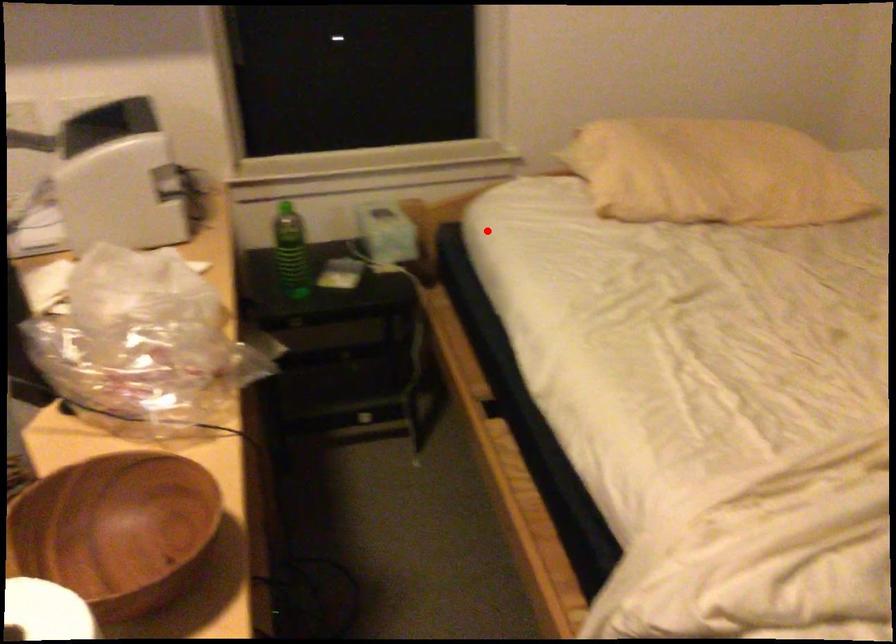
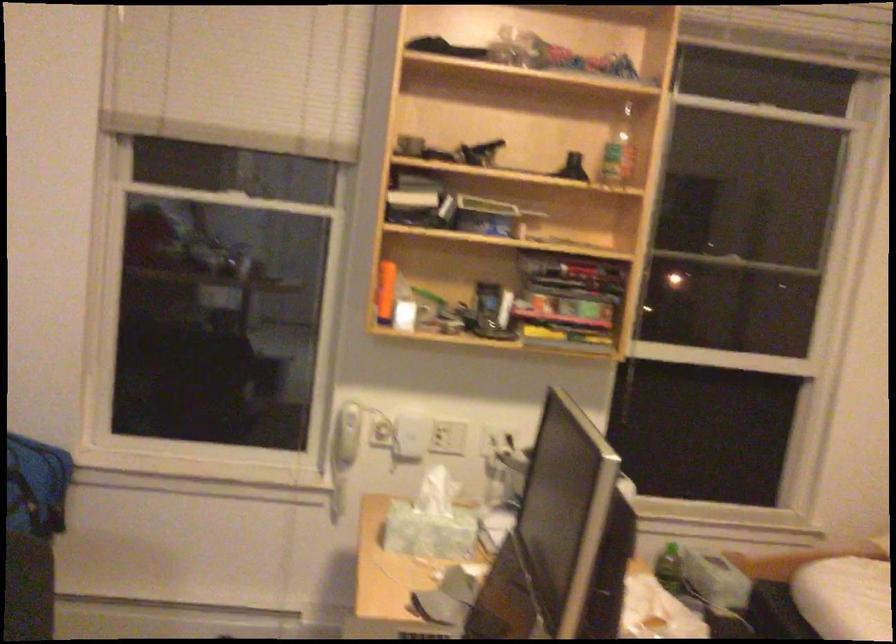
Question: I am providing you with two images of the same scene from different viewpoints. A red point is marked on the first image. Is the red point's position out of view in image 2?

Choices:
 (A) Yes
 (B) No

Answer: (B)